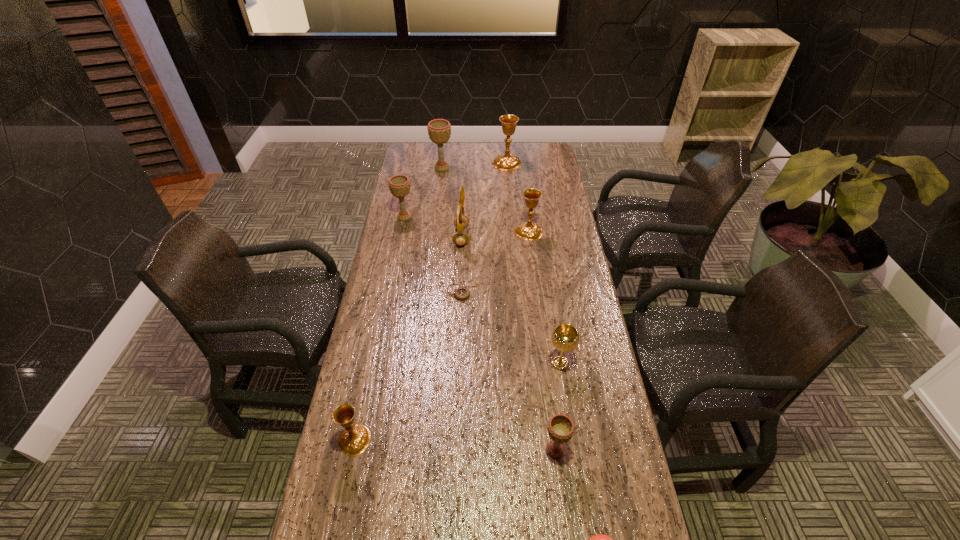
Identify the location of the nearest gold chalice. This screenshot has width=960, height=540. (354, 439).

The width and height of the screenshot is (960, 540). What are the coordinates of `the leftmost gold chalice` in the screenshot? It's located at (354, 439).

The image size is (960, 540). I want to click on the sixth farthest object, so click(462, 293).

Find the location of a particular element. This screenshot has height=540, width=960. pocket watch is located at coordinates (462, 293).

The height and width of the screenshot is (540, 960). Find the location of `free region located 0.240m on the left of the farthest gold chalice`. free region located 0.240m on the left of the farthest gold chalice is located at coordinates (443, 163).

Locate an element on the screen. The image size is (960, 540). vacant space situated on the right of the farthest beige chalice is located at coordinates pyautogui.click(x=485, y=168).

Identify the location of vacant space located 0.100m on the front-facing side of the earphone. Image resolution: width=960 pixels, height=540 pixels. (494, 237).

In order to click on vacant region located 0.180m on the back of the second smallest beige chalice in this screenshot , I will do `click(410, 187)`.

Where is `vacant position located on the left of the second nearest gold chalice`? Image resolution: width=960 pixels, height=540 pixels. vacant position located on the left of the second nearest gold chalice is located at coordinates (490, 232).

Where is `vacant region located 0.090m on the left of the third nearest chalice`? The width and height of the screenshot is (960, 540). vacant region located 0.090m on the left of the third nearest chalice is located at coordinates (516, 363).